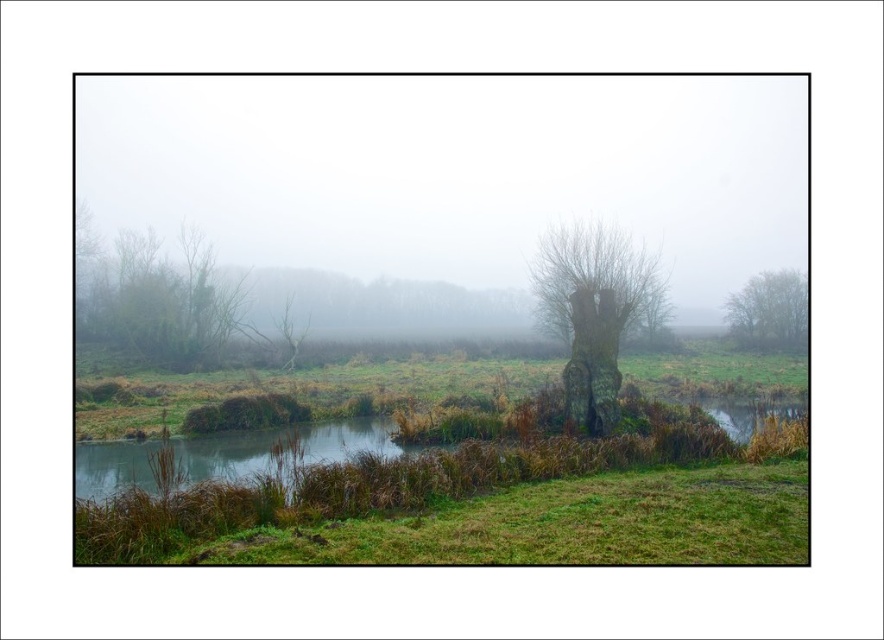
Between brown dry grass at center and green matte tree at right, which one is positioned lower?

Positioned lower is brown dry grass at center.

Is point (127, 500) farther from viewer compared to point (768, 294)?

That is False.

Between point (726, 456) and point (789, 310), which one is positioned in front?

Point (726, 456)

You are a GUI agent. You are given a task and a screenshot of the screen. Output one action in this format:
    pyautogui.click(x=<x>, y=<y>)
    Task: Click on the brown dry grass at center
    The width and height of the screenshot is (884, 640).
    Given the screenshot: What is the action you would take?
    pyautogui.click(x=448, y=467)

Is foggy misty atmosphere at center above brown dry grass at center?

Yes, foggy misty atmosphere at center is above brown dry grass at center.

Is foggy misty atmosphere at center closer to the viewer compared to brown dry grass at center?

No, foggy misty atmosphere at center is further to the viewer.

I want to click on foggy misty atmosphere at center, so click(452, 188).

Can you confirm if green mossy tree trunk at center is positioned to the left of green matte tree at right?

Indeed, green mossy tree trunk at center is positioned on the left side of green matte tree at right.

Between point (601, 266) and point (799, 289), which one is positioned in front?

Positioned in front is point (601, 266).

Locate an element on the screen. The width and height of the screenshot is (884, 640). green mossy tree trunk at center is located at coordinates [x=595, y=308].

Locate an element on the screen. The image size is (884, 640). green mossy tree trunk at center is located at coordinates (595, 308).